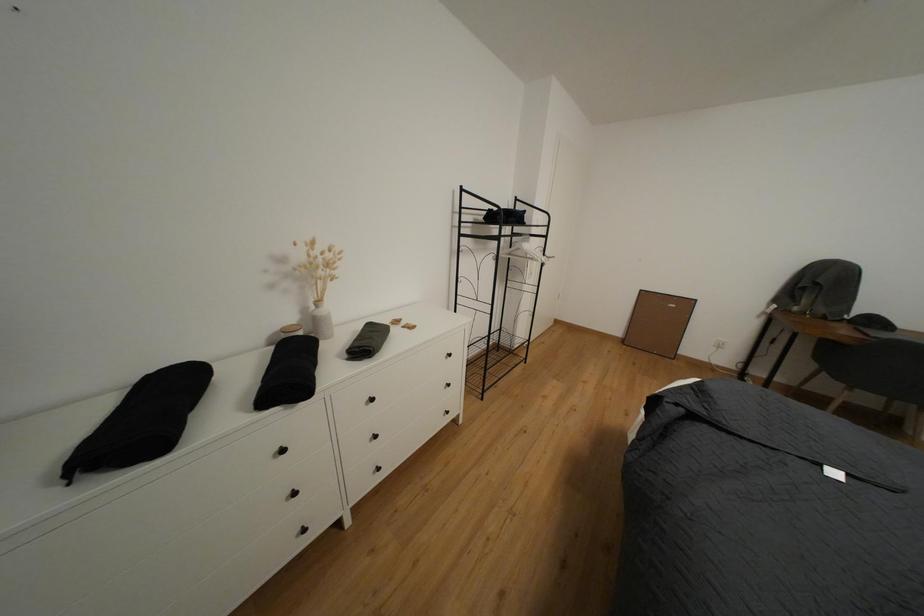
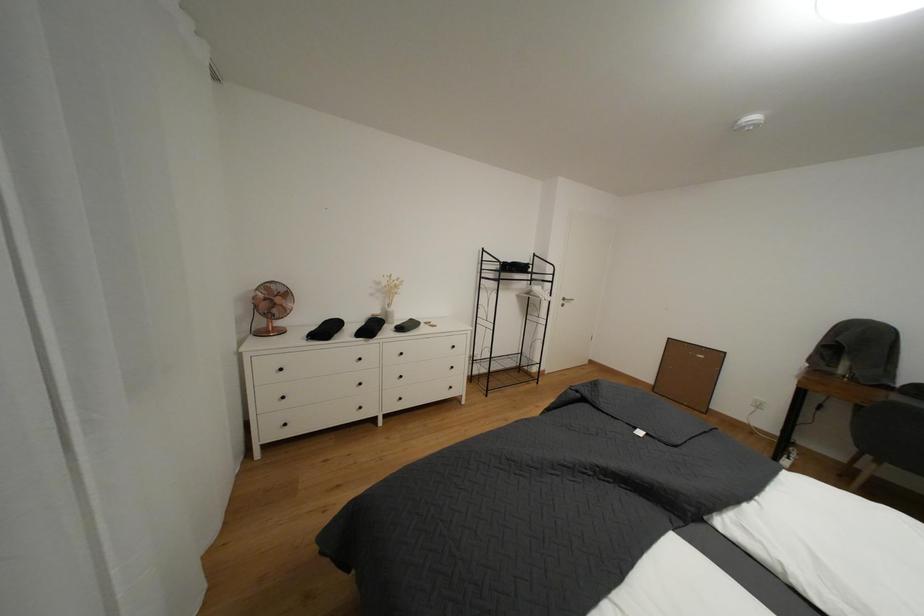
In a continuous first-person perspective shot, in which direction is the camera moving?

The cameraman moved toward right, backward.